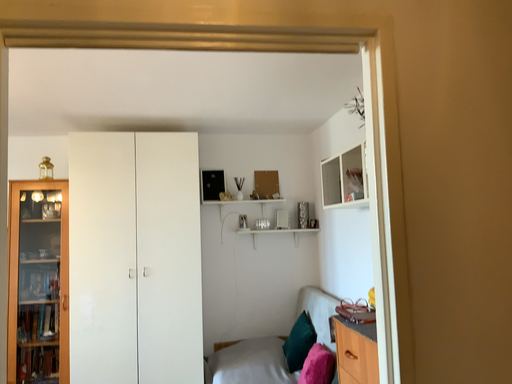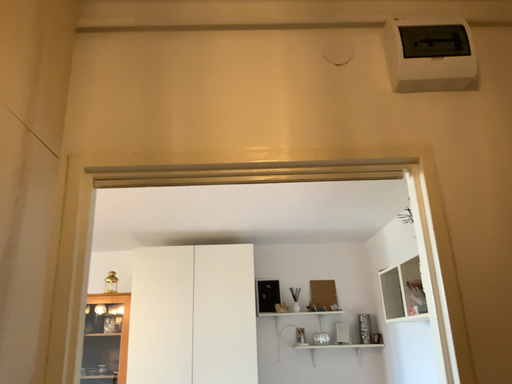
Question: Which way did the camera rotate in the video?

Choices:
 (A) rotated upward
 (B) rotated downward

Answer: (A)